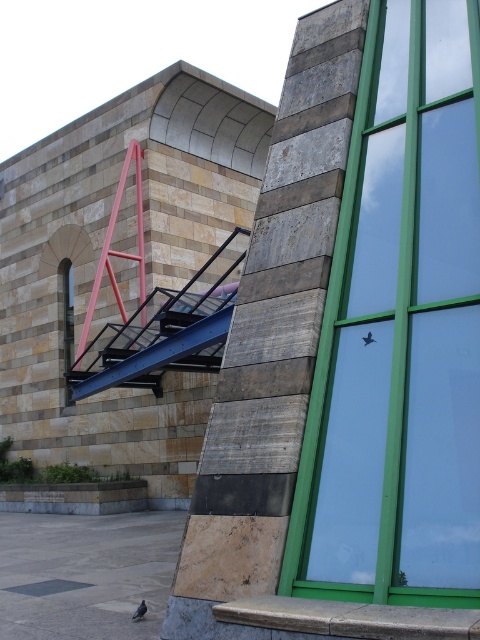
Question: Which object appears farthest from the camera in this image?

Choices:
 (A) blue metallic stair at center
 (B) green glass window at center

Answer: (A)

Question: Where is green glass window at center located in relation to blue metallic stair at center in the image?

Choices:
 (A) left
 (B) right

Answer: (B)

Question: Can you confirm if green glass window at center is bigger than blue metallic stair at center?

Choices:
 (A) yes
 (B) no

Answer: (B)

Question: Does green glass window at center have a smaller size compared to blue metallic stair at center?

Choices:
 (A) no
 (B) yes

Answer: (B)

Question: Among these points, which one is nearest to the camera?

Choices:
 (A) (171, 326)
 (B) (452, 104)

Answer: (B)